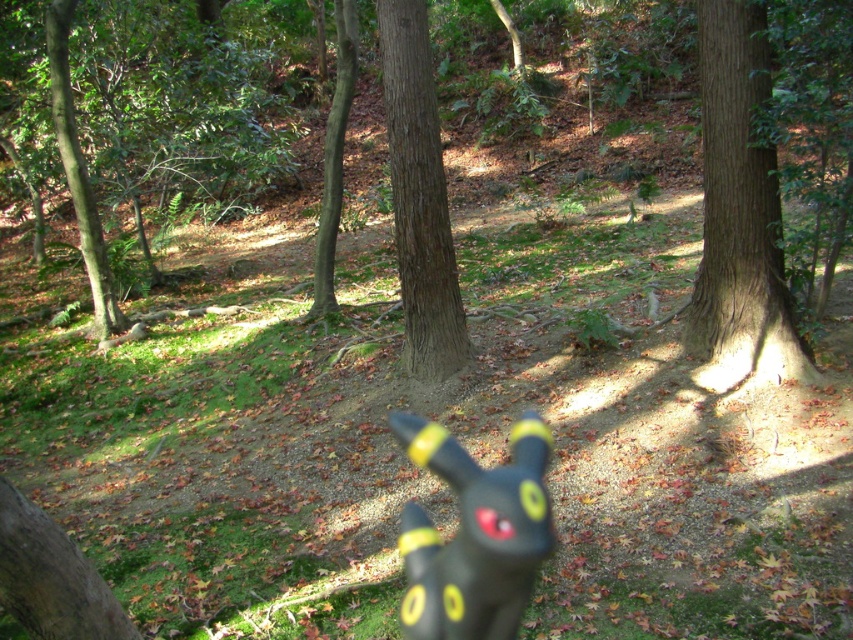
You are a hiker who has spotted the black rubber toy at center and the brown rough tree at center in the forest. Which object is positioned more to the east if you are facing north?

The black rubber toy at center is to the right of the brown rough tree at center. Since you are facing north, right would be east, so the black rubber toy at center is more to the east.

You are a hiker who has just found a black rubber toy at center and a brown rough tree at center in the forest. Which object is taller?

The black rubber toy at center is not as tall as the brown rough tree at center, so the brown rough tree at center is taller.